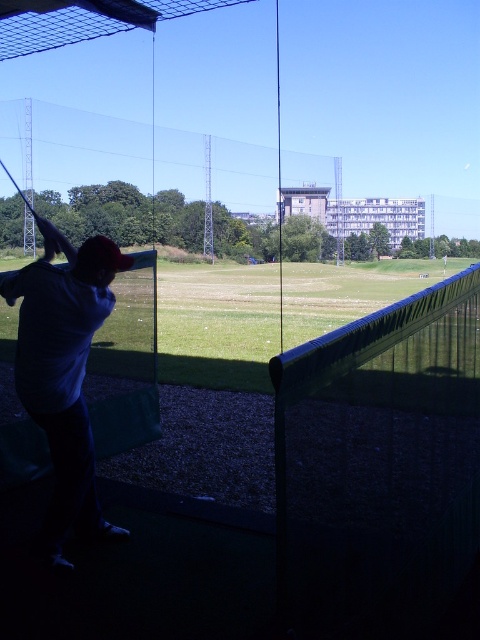
Is green grass at center below dark blue shirt at left?

No.

Between point (298, 321) and point (123, 262), which one is positioned behind?

Positioned behind is point (298, 321).

Which is behind, point (252, 326) or point (60, 557)?

Point (252, 326)

Identify the location of green grass at center. (216, 326).